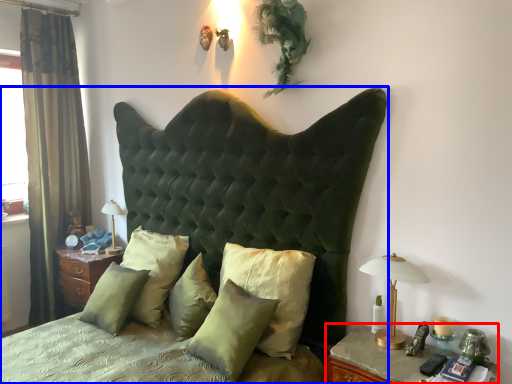
Question: Which object appears farthest to the camera in this image, nightstand (highlighted by a red box) or bed (highlighted by a blue box)?

Choices:
 (A) nightstand
 (B) bed

Answer: (A)